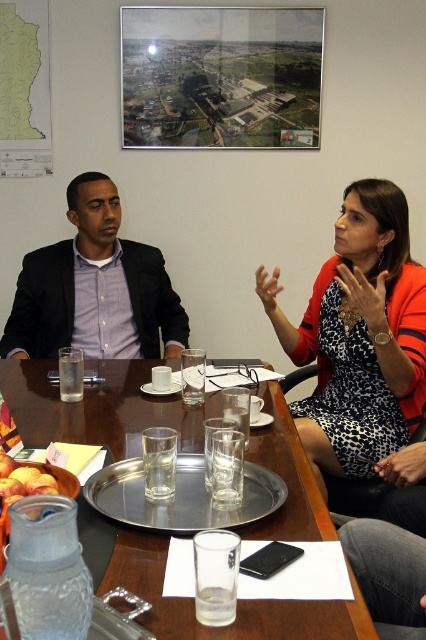
Who is more forward, (417, 317) or (54, 292)?

Point (417, 317) is in front.

Which of these two, leopard print dress at center or matte black suit at left, stands shorter?

matte black suit at left is shorter.

Who is more forward, (411,401) or (14,337)?

Point (411,401) is more forward.

This screenshot has height=640, width=426. I want to click on leopard print dress at center, so click(359, 337).

Does leopard print dress at center have a smaller size compared to wooden table at center?

Correct, leopard print dress at center occupies less space than wooden table at center.

Between leopard print dress at center and wooden table at center, which one has more height?

Standing taller between the two is leopard print dress at center.

The image size is (426, 640). Describe the element at coordinates (359, 337) in the screenshot. I see `leopard print dress at center` at that location.

Locate an element on the screen. leopard print dress at center is located at coordinates (359, 337).

Which is in front, point (45, 401) or point (31, 333)?

Point (45, 401) is in front.

Is wooden table at center thinner than matte black suit at left?

Incorrect, wooden table at center's width is not less than matte black suit at left's.

Find the location of a particular element. wooden table at center is located at coordinates (97, 406).

Image resolution: width=426 pixels, height=640 pixels. What are the coordinates of `wooden table at center` in the screenshot? It's located at (97, 406).